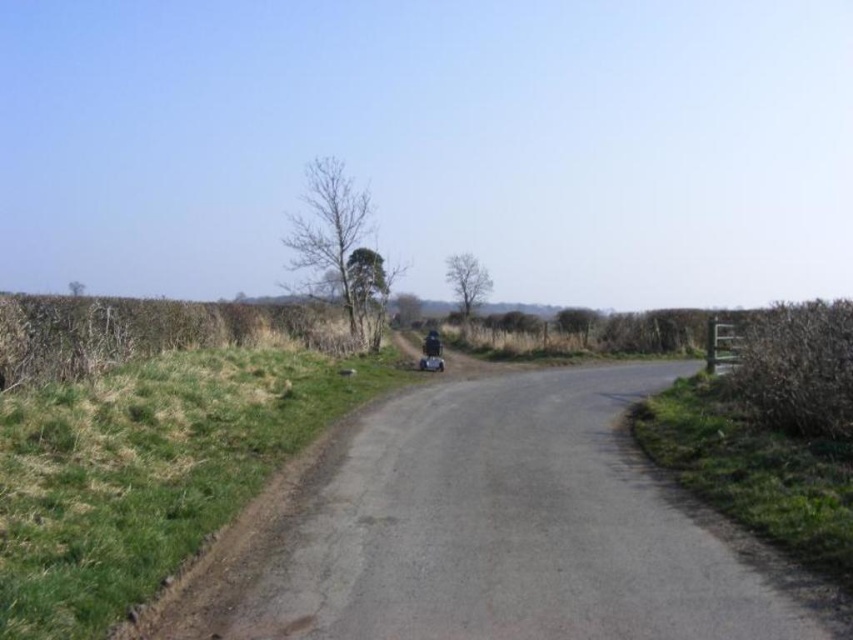
You are a cyclist wearing a helmet and riding along the paved road in the countryside. You notice the shiny black helmet at center and the brown dry hedge at left. Which object is closer to your left side as you ride forward?

The brown dry hedge at left is closer to your left side as you ride forward because it is positioned to the left of the shiny black helmet at center, which is in the center of your view.